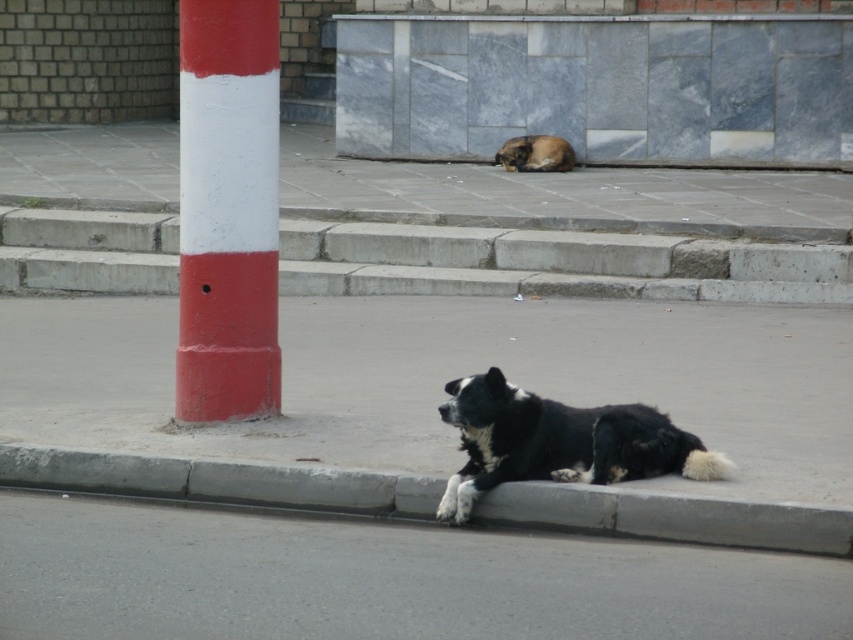
What do you see at coordinates (560, 442) in the screenshot? I see `black fur dog at lower center` at bounding box center [560, 442].

From the picture: Does black fur dog at lower center appear under brown fur dog at center?

Yes.

Who is more distant from viewer, (584, 458) or (525, 161)?

The point (525, 161) is more distant.

The height and width of the screenshot is (640, 853). Identify the location of black fur dog at lower center. (560, 442).

Does concrete stairs at center appear on the left side of gray concrete curb at lower center?

In fact, concrete stairs at center is to the right of gray concrete curb at lower center.

Between point (19, 259) and point (815, 536), which one is positioned behind?

Point (19, 259)

Which is behind, point (635, 275) or point (212, 499)?

The point (635, 275) is behind.

Locate an element on the screen. concrete stairs at center is located at coordinates (554, 262).

Who is more distant from viewer, (184, 122) or (521, 147)?

The point (521, 147) is more distant.

Can you confirm if red/white painted pole at left is positioned to the right of brown fur dog at center?

Incorrect, red/white painted pole at left is not on the right side of brown fur dog at center.

Who is more forward, (253, 202) or (538, 138)?

Point (253, 202)

The image size is (853, 640). I want to click on red/white painted pole at left, so click(227, 211).